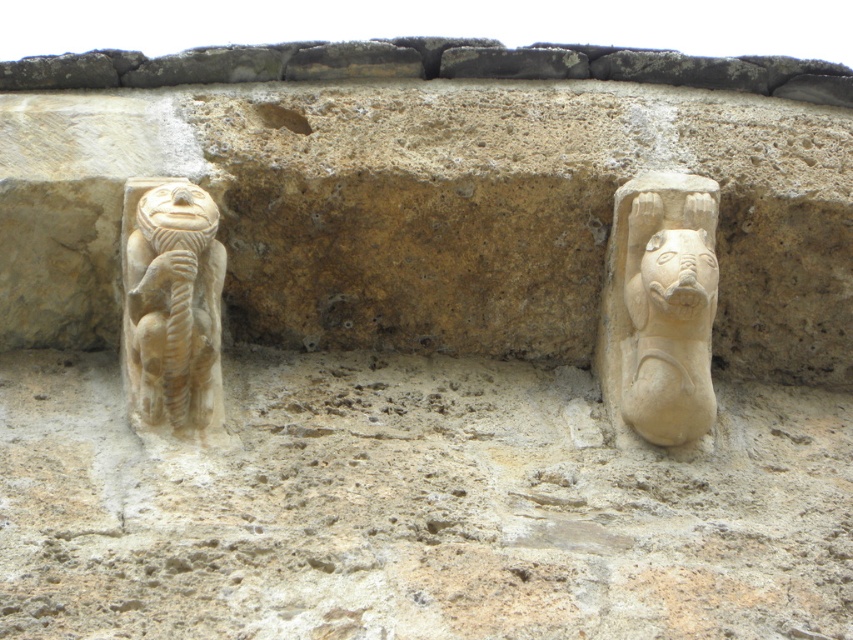
You are an archaeologist examining the stone wall. You need to determine which of the two figures, the beige stone lion at right or the beige stone monkey at left, is narrower. Based on the carving details, which one should you conclude is narrower?

The beige stone lion at right is narrower than the beige stone monkey at left because its width is less than that of the monkey.

You are an archaeologist examining the stone wall. You notice the beige stone monkey at left and the white stone face at right. Based on their positions, which one is closer to you?

The beige stone monkey at left is closer to you because it is in front of the white stone face at right.

You are an architect designing a new garden pathway. The pathway must be wide enough to allow a 20 feet wide sculpture truck to pass between the beige stone lion at right and the beige stone monkey at left. Based on the scene description, will the truck fit through the space between them?

The beige stone lion at right and beige stone monkey at left are 20.92 feet apart. Since the truck is 20 feet wide, there is a clearance of 0.92 feet, so the truck can pass through the space between them.